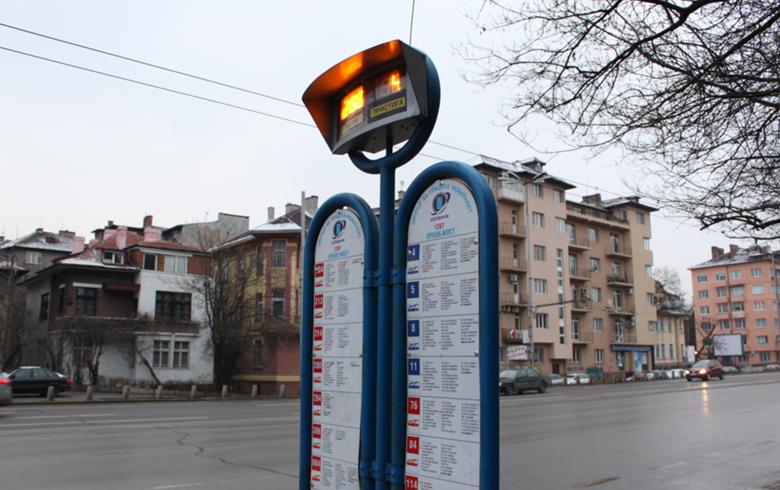
At what (x,y) coordinates should I click in order to perform the action: click on chimney. Please return your answer as a coordinate pair (x, y). Looking at the image, I should click on (268, 210), (292, 204), (310, 203), (147, 218).